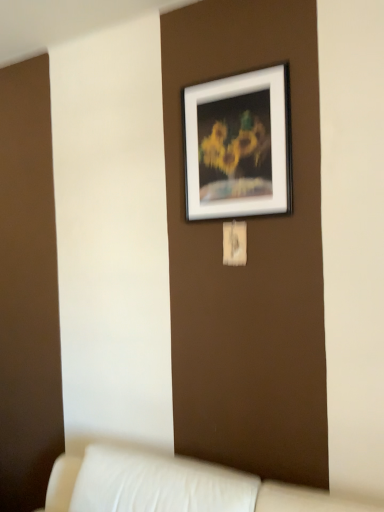
What is the approximate width of white matte picture frame at upper center?

white matte picture frame at upper center is 1.52 inches in width.

The height and width of the screenshot is (512, 384). Find the location of `white matte picture frame at upper center`. white matte picture frame at upper center is located at coordinates (238, 145).

This screenshot has width=384, height=512. Describe the element at coordinates (238, 145) in the screenshot. I see `white matte picture frame at upper center` at that location.

Image resolution: width=384 pixels, height=512 pixels. I want to click on white matte picture frame at upper center, so click(x=238, y=145).